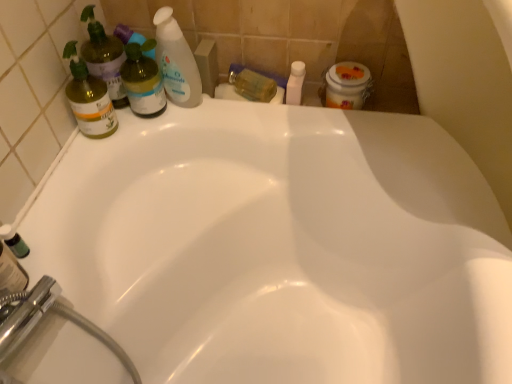
Question: From a real-world perspective, is white plastic bottle at upper center, the second toiletry in the left-to-right sequence, physically above translucent plastic bottle at upper left, the 1th cleaning product positioned from the right?

Choices:
 (A) yes
 (B) no

Answer: (B)

Question: From a real-world perspective, is white plastic bottle at upper center, the second toiletry in the left-to-right sequence, located beneath translucent plastic bottle at upper left, placed as the third cleaning product when sorted from left to right?

Choices:
 (A) yes
 (B) no

Answer: (A)

Question: Does white plastic bottle at upper center, acting as the 1th toiletry starting from the right, come behind translucent plastic bottle at upper left, placed as the third cleaning product when sorted from left to right?

Choices:
 (A) no
 (B) yes

Answer: (B)

Question: Is white plastic bottle at upper center, acting as the 1th toiletry starting from the right, aimed at translucent plastic bottle at upper left, placed as the third cleaning product when sorted from left to right?

Choices:
 (A) no
 (B) yes

Answer: (A)

Question: Is white plastic bottle at upper center, acting as the 1th toiletry starting from the right, wider than translucent plastic bottle at upper left, placed as the third cleaning product when sorted from left to right?

Choices:
 (A) yes
 (B) no

Answer: (A)

Question: Looking at the image, does matte green bottle at left, which is counted as the 2th cleaning product, starting from the right, seem bigger or smaller compared to green matte bottle at lower left?

Choices:
 (A) small
 (B) big

Answer: (B)

Question: From the image's perspective, is matte green bottle at left, which is counted as the 2th cleaning product, starting from the right, located above or below green matte bottle at lower left?

Choices:
 (A) below
 (B) above

Answer: (B)

Question: Considering the relative positions of matte green bottle at left, which is counted as the 2th cleaning product, starting from the right, and green matte bottle at lower left in the image provided, is matte green bottle at left, which is counted as the 2th cleaning product, starting from the right, to the left or to the right of green matte bottle at lower left?

Choices:
 (A) right
 (B) left

Answer: (A)

Question: Is point (80, 54) positioned closer to the camera than point (7, 230)?

Choices:
 (A) farther
 (B) closer

Answer: (A)

Question: From the image's perspective, is green glass spray bottle at left, the first cleaning product positioned from the left, positioned above or below white plastic bottle at upper center, the second toiletry in the left-to-right sequence?

Choices:
 (A) above
 (B) below

Answer: (B)

Question: Does point (102, 89) appear closer or farther from the camera than point (297, 99)?

Choices:
 (A) farther
 (B) closer

Answer: (B)

Question: Would you say green glass spray bottle at left, the 3th cleaning product from the right, is to the left or to the right of white plastic bottle at upper center, acting as the 1th toiletry starting from the right, in the picture?

Choices:
 (A) right
 (B) left

Answer: (B)

Question: From a real-world perspective, is green glass spray bottle at left, the first cleaning product positioned from the left, above or below white plastic bottle at upper center, the second toiletry in the left-to-right sequence?

Choices:
 (A) below
 (B) above

Answer: (B)

Question: Would you say translucent yellow bottle at upper center, which appears as the first toiletry when viewed from the left, is inside or outside translucent plastic bottle at upper left, placed as the third cleaning product when sorted from left to right?

Choices:
 (A) outside
 (B) inside

Answer: (A)

Question: Considering the positions of translucent yellow bottle at upper center, which appears as the first toiletry when viewed from the left, and translucent plastic bottle at upper left, the 1th cleaning product positioned from the right, in the image, is translucent yellow bottle at upper center, which appears as the first toiletry when viewed from the left, wider or thinner than translucent plastic bottle at upper left, the 1th cleaning product positioned from the right,?

Choices:
 (A) thin
 (B) wide

Answer: (B)